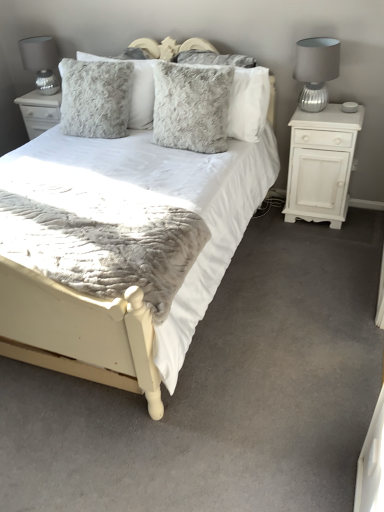
Question: Considering their positions, is fuzzy gray pillow at center, placed as the second pillow when sorted from right to left, located in front of or behind satin silver lampshade at upper left, which is the second table lamp in front-to-back order?

Choices:
 (A) front
 (B) behind

Answer: (A)

Question: From a real-world perspective, relative to satin silver lampshade at upper left, marked as the first table lamp in a left-to-right arrangement, is fuzzy gray pillow at center, which ranks as the second pillow in left-to-right order, vertically above or below?

Choices:
 (A) above
 (B) below

Answer: (B)

Question: Which of these objects is positioned farthest from the white matte cabinet at right?

Choices:
 (A) silver ribbed glass table lamp at right, which is the 2th table lamp in left-to-right order
 (B) fuzzy gray pillow at center, the first pillow in the right-to-left sequence
 (C) satin silver lampshade at upper left, the second table lamp positioned from the right
 (D) fuzzy gray pillow at upper center, which is counted as the first pillow, starting from the left
 (E) white fabric bed at center

Answer: (C)

Question: Based on their relative distances, which object is nearer to the fuzzy gray pillow at center, which ranks as the second pillow in left-to-right order?

Choices:
 (A) white fabric bed at center
 (B) fuzzy gray pillow at upper center, which is counted as the first pillow, starting from the left
 (C) satin silver lampshade at upper left, marked as the first table lamp in a left-to-right arrangement
 (D) fuzzy gray pillow at center, the third pillow from the left
 (E) silver ribbed glass table lamp at right, which is the 1th table lamp in right-to-left order

Answer: (D)